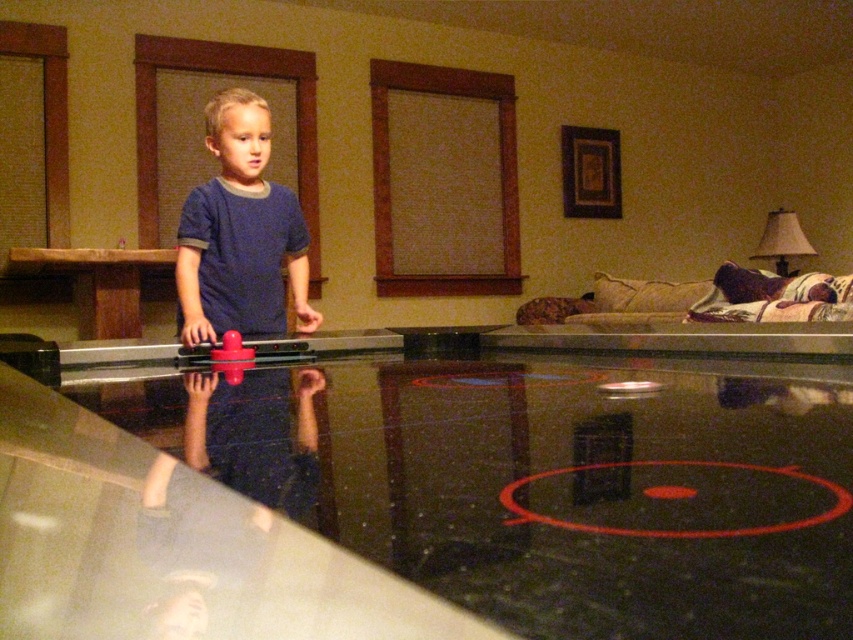
Question: Which point is farther from the camera taking this photo?

Choices:
 (A) (227, 339)
 (B) (692, 529)

Answer: (A)

Question: Which point is farther to the camera?

Choices:
 (A) transparent glass table at center
 (B) rubberized plastic toy at center

Answer: (B)

Question: Is blue matte shirt at center to the right of rubberized plastic toy at center from the viewer's perspective?

Choices:
 (A) yes
 (B) no

Answer: (B)

Question: Which point appears farthest from the camera in this image?

Choices:
 (A) (215, 348)
 (B) (250, 161)
 (C) (106, 552)

Answer: (B)

Question: Is transparent glass table at center above rubberized plastic toy at center?

Choices:
 (A) yes
 (B) no

Answer: (B)

Question: Can you confirm if transparent glass table at center is thinner than blue matte shirt at center?

Choices:
 (A) no
 (B) yes

Answer: (A)